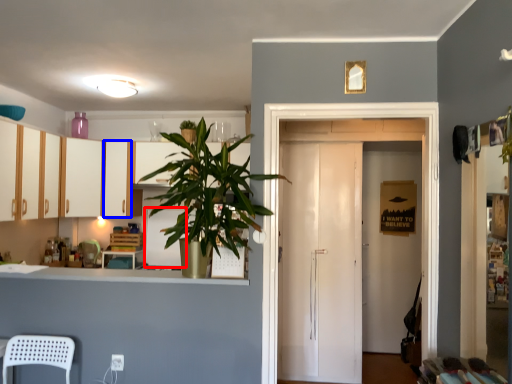
Question: Which object appears closest to the camera in this image, appliance (highlighted by a red box) or cabinetry (highlighted by a blue box)?

Choices:
 (A) appliance
 (B) cabinetry

Answer: (B)